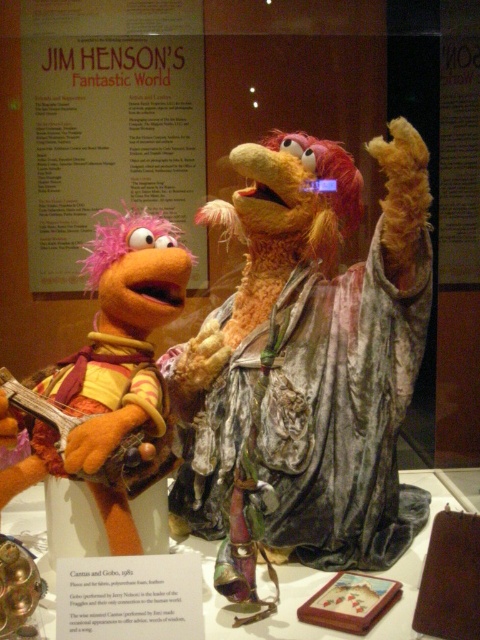
Question: Is velvet-like robe at center above orange plush puppet at left?

Choices:
 (A) no
 (B) yes

Answer: (B)

Question: Can you confirm if velvet-like robe at center is positioned to the right of orange plush puppet at left?

Choices:
 (A) no
 (B) yes

Answer: (B)

Question: Which object is farther from the camera taking this photo?

Choices:
 (A) orange plush puppet at left
 (B) velvet-like robe at center

Answer: (B)

Question: Can you confirm if velvet-like robe at center is bigger than orange plush puppet at left?

Choices:
 (A) no
 (B) yes

Answer: (B)

Question: Which of the following is the farthest from the observer?

Choices:
 (A) (404, 152)
 (B) (71, 388)

Answer: (B)